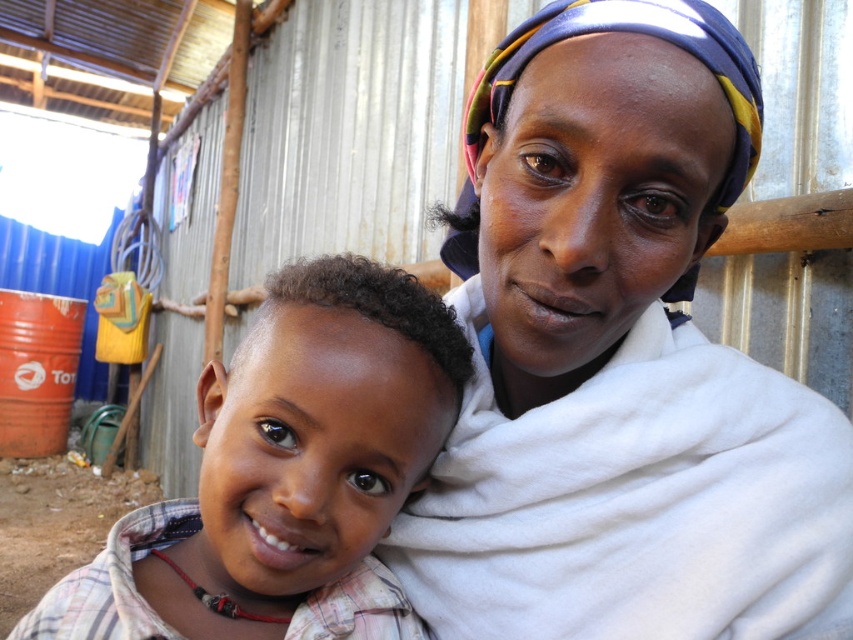
Question: Does white cloth at center have a lesser width compared to light brown plaid shirt at center?

Choices:
 (A) no
 (B) yes

Answer: (A)

Question: From the image, what is the correct spatial relationship of white cloth at center in relation to light brown plaid shirt at center?

Choices:
 (A) left
 (B) right

Answer: (B)

Question: Does white cloth at center appear on the right side of light brown plaid shirt at center?

Choices:
 (A) no
 (B) yes

Answer: (B)

Question: Which point appears farthest from the camera in this image?

Choices:
 (A) (730, 545)
 (B) (190, 518)

Answer: (B)

Question: Among these objects, which one is farthest from the camera?

Choices:
 (A) white cloth at center
 (B) light brown plaid shirt at center

Answer: (A)